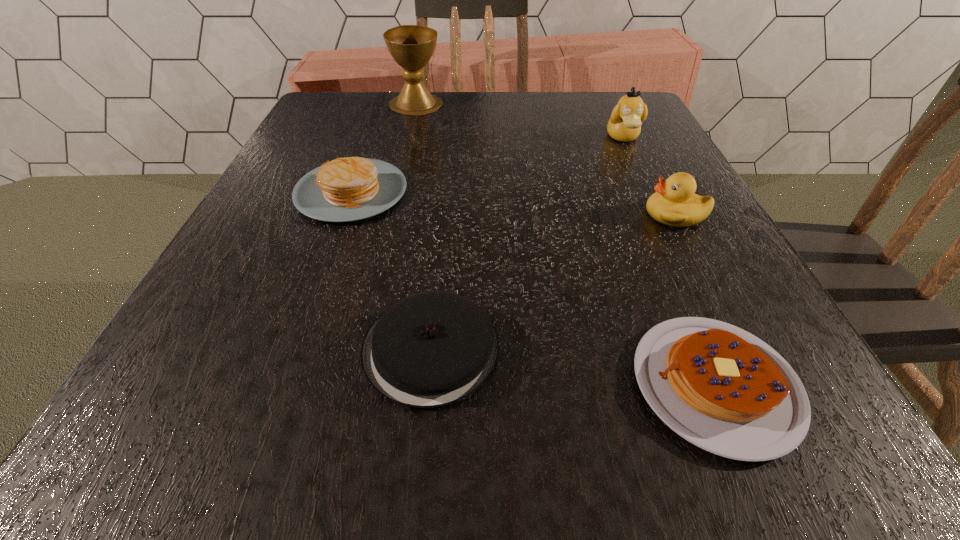
Find the location of a particular element. The width and height of the screenshot is (960, 540). unoccupied position between the farthest pancake and the rightmost pancake is located at coordinates (533, 288).

The image size is (960, 540). Find the location of `free spot between the fifth nearest object and the shortest object`. free spot between the fifth nearest object and the shortest object is located at coordinates (669, 261).

What are the coordinates of `the fifth closest object to the shortest object` in the screenshot? It's located at (411, 46).

Find the location of `the second closest object to the tallest object`. the second closest object to the tallest object is located at coordinates (626, 119).

Identify which pancake is the nearest to the shortest pancake. Please provide its 2D coordinates. Your answer should be formatted as a tuple, i.e. [(x, y)], where the tuple contains the x and y coordinates of a point satisfying the conditions above.

[(431, 349)]

Identify which pancake is the second closest to the farthest pancake. Please provide its 2D coordinates. Your answer should be formatted as a tuple, i.e. [(x, y)], where the tuple contains the x and y coordinates of a point satisfying the conditions above.

[(721, 388)]

What are the coordinates of `vacant space that satisfies the following two spatial constraints: 1. on the back side of the farthest object; 2. on the left side of the farthest pancake` in the screenshot? It's located at (383, 104).